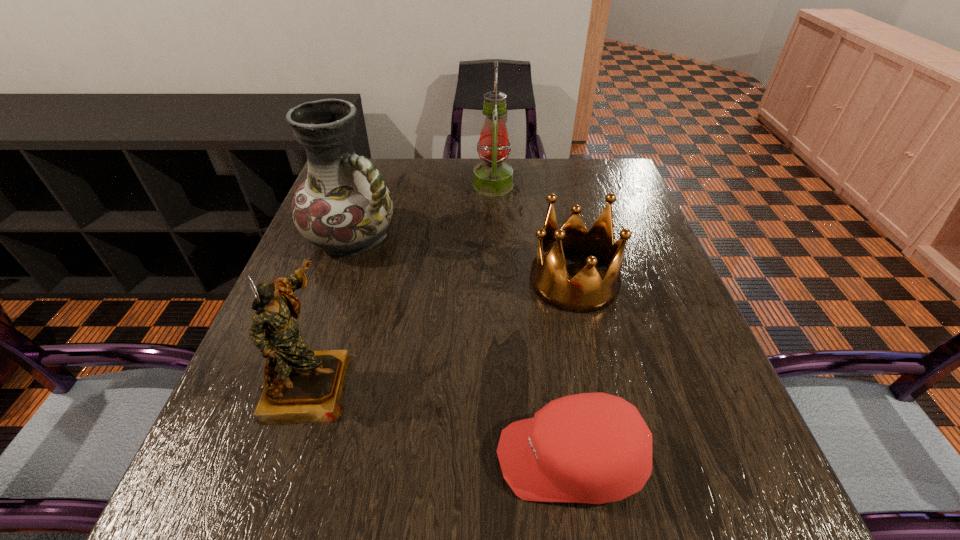
In order to click on vacant area between the vase and the farthest object in this screenshot , I will do `click(423, 211)`.

At what (x,y) coordinates should I click in order to perform the action: click on blank region between the vase and the farthest object. Please return your answer as a coordinate pair (x, y). Looking at the image, I should click on (423, 211).

Locate an element on the screen. This screenshot has width=960, height=540. free space between the cap and the vase is located at coordinates (462, 348).

Find the location of a particular element. The height and width of the screenshot is (540, 960). the second closest object to the fourth tallest object is located at coordinates (595, 448).

Point out which object is positioned as the third nearest to the shortest object. Please provide its 2D coordinates. Your answer should be formatted as a tuple, i.e. [(x, y)], where the tuple contains the x and y coordinates of a point satisfying the conditions above.

[(344, 206)]

Identify the location of vacant position in the image that satisfies the following two spatial constraints: 1. on the back side of the oil lamp; 2. on the right side of the vase. (372, 185).

This screenshot has width=960, height=540. I want to click on blank space that satisfies the following two spatial constraints: 1. on the front side of the fourth tallest object; 2. on the front-facing side of the figurine, so click(597, 383).